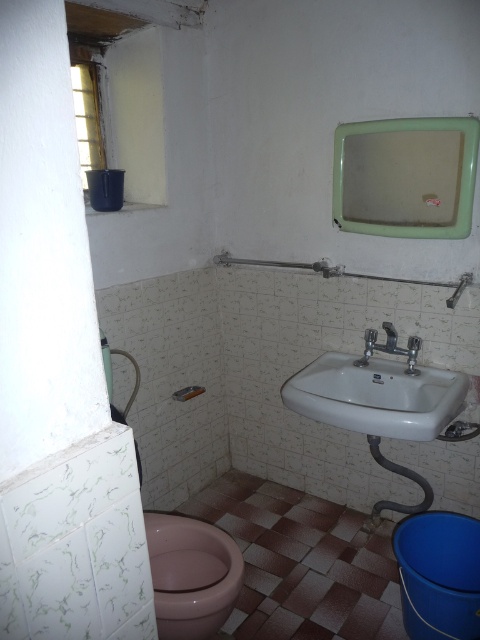
You are a plumber inspecting the bathroom and need to determine if the white glossy sink at lower right can accommodate a new faucet. The new faucet requires a space that is at least as large as the current silver metallic faucet at sink right. Can the sink accommodate the new faucet?

The white glossy sink at lower right is bigger than the silver metallic faucet at sink right, so it can accommodate the new faucet as long as the required space is at least as large as the current faucet.

You are standing in the bathroom and want to look into the mirror. Which object, the green plastic mirror at upper center or the silver metallic faucet at sink right, is closer to you?

The green plastic mirror at upper center is closer to you because it is in front of the silver metallic faucet at sink right.